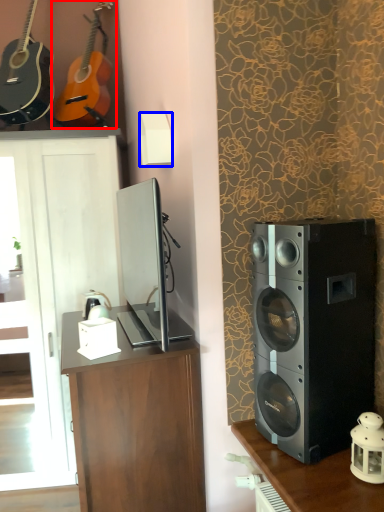
Question: Which of the following is the farthest to the observer, guitar (highlighted by a red box) or lamp (highlighted by a blue box)?

Choices:
 (A) guitar
 (B) lamp

Answer: (A)